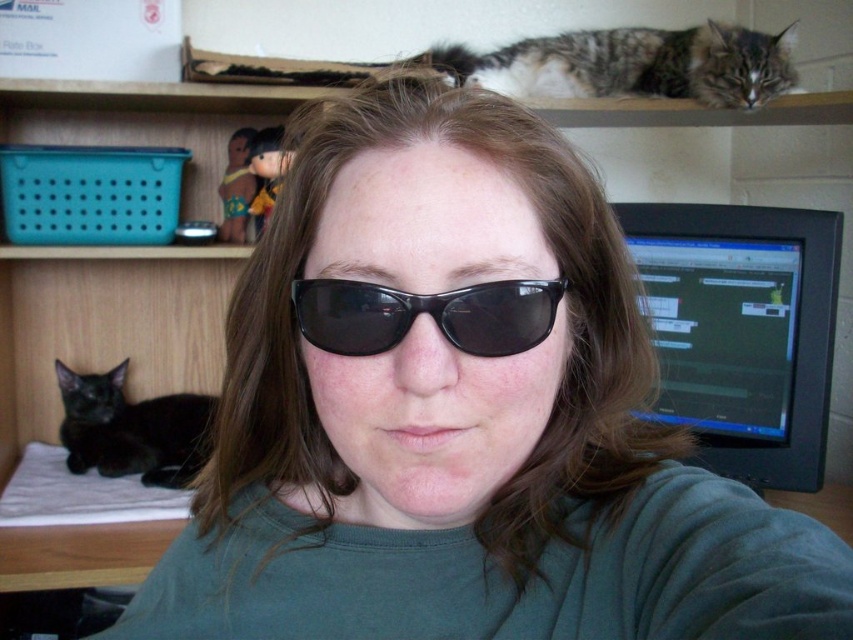
You are a photographer trying to capture a closeup of the tabby fur cat at upper center and the black plastic sunglasses at center. Since the camera can only focus on one object at a time, which object should you choose to ensure it appears clearer in the photo?

The tabby fur cat at upper center is larger in size than the black plastic sunglasses at center, so it would be better to focus on the tabby fur cat at upper center to ensure it appears clearer in the photo.

You are a photographer adjusting your camera to focus on two specific points in the image. The first point is at coordinates point (723, 212), and the second point is at coordinates point (523, 314). Which point should you focus on first if you want to capture the closest object to the camera?

Point (723, 212) is further to the camera than point (523, 314), so you should focus on point (723, 212) first since it is closer to the camera.

You are standing in front of the computer setup and want to place a small sticker on the point that is closer to you. Which point should you choose between point (x=822, y=406) and point (x=91, y=381)?

Point (x=91, y=381) is closer to you because it is behind point (x=822, y=406), which is in front of it.